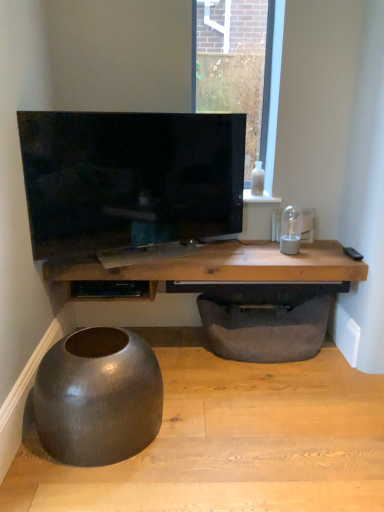
Locate an element on the screen. free point below matte black tv at center (from a real-world perspective) is located at coordinates (154, 254).